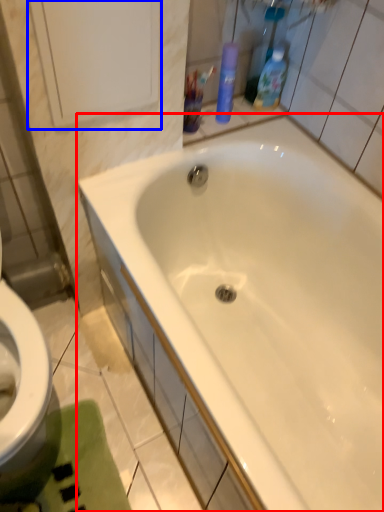
Question: Among these objects, which one is farthest to the camera, bathtub (highlighted by a red box) or medicine cabinet (highlighted by a blue box)?

Choices:
 (A) bathtub
 (B) medicine cabinet

Answer: (B)